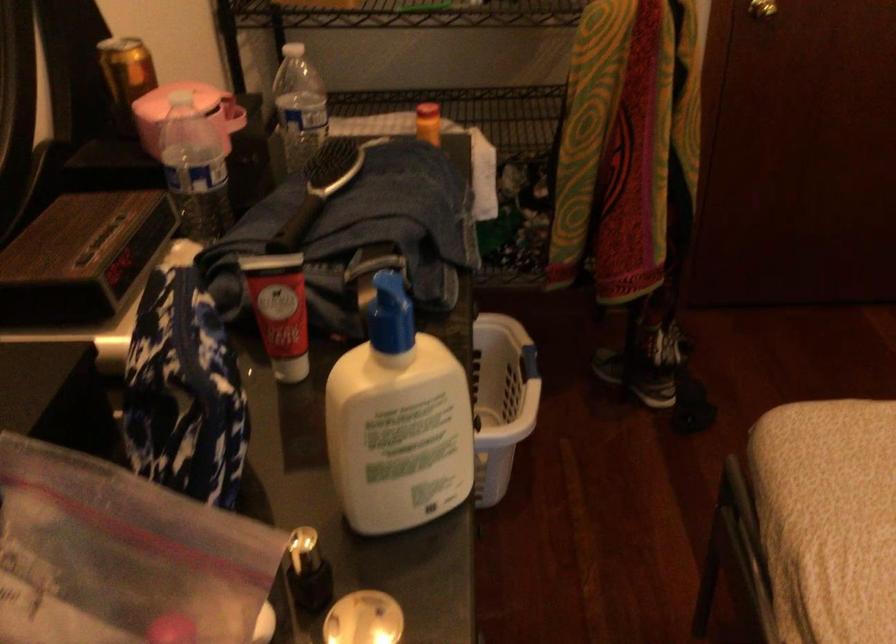
Where would you lift the black hairbrush handle? Please return your answer as a coordinate pair (x, y).

(337, 164)